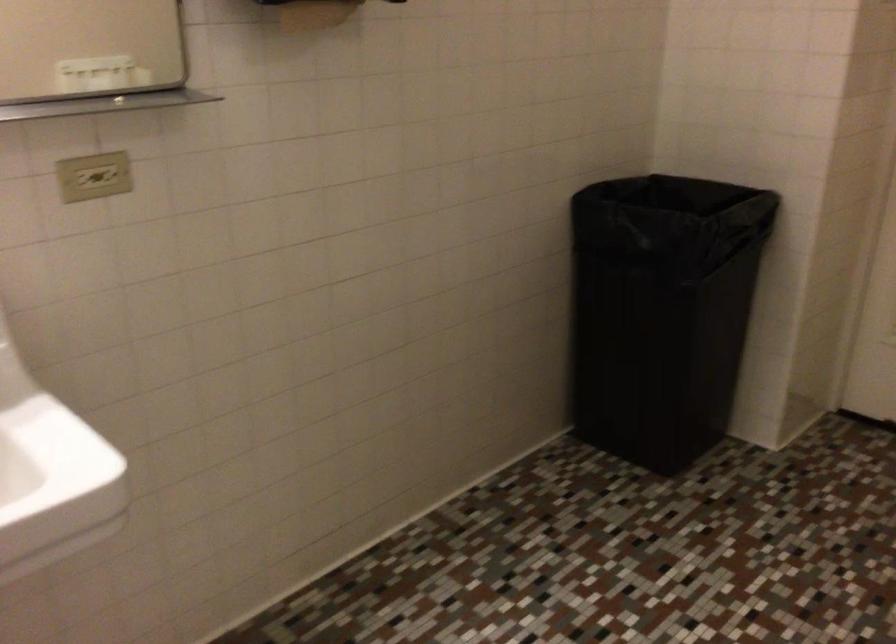
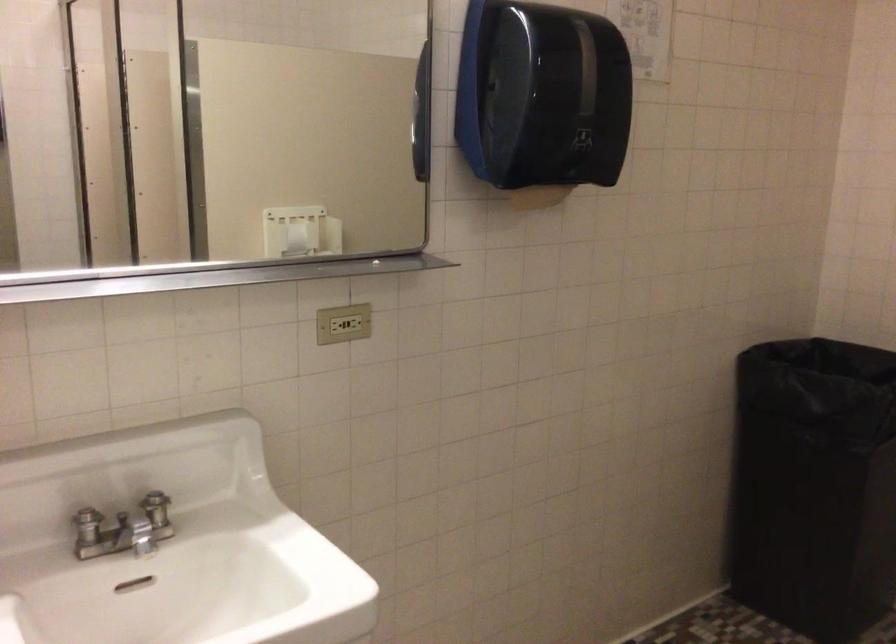
Question: The first image is from the beginning of the video and the second image is from the end. How did the camera likely rotate when shooting the video?

Choices:
 (A) Left
 (B) Right
 (C) Up
 (D) Down

Answer: (A)